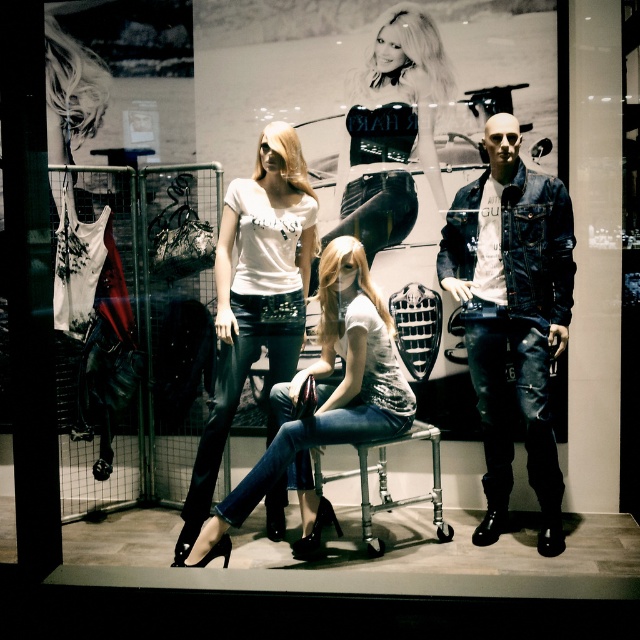
Question: Which is nearer to the denim jeans at center?

Choices:
 (A) shiny black leather top at upper center
 (B) white matte t-shirt at center

Answer: (B)

Question: Which object is positioned farthest from the shiny black leather top at upper center?

Choices:
 (A) denim jeans at center
 (B) denim jacket at center

Answer: (A)

Question: In this image, where is denim jacket at center located relative to shiny black leather top at upper center?

Choices:
 (A) above
 (B) below

Answer: (B)

Question: Which object is positioned closest to the white matte t-shirt at center?

Choices:
 (A) denim jacket at center
 (B) shiny black leather top at upper center
 (C) denim jeans at center

Answer: (C)

Question: Can you confirm if denim jacket at center is positioned to the left of white matte t-shirt at center?

Choices:
 (A) no
 (B) yes

Answer: (A)

Question: Is denim jacket at center behind white matte t-shirt at center?

Choices:
 (A) no
 (B) yes

Answer: (B)